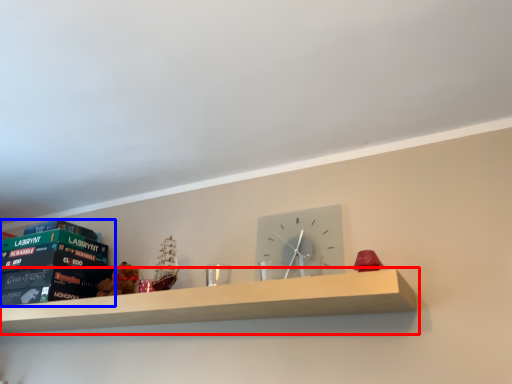
Question: Among these objects, which one is nearest to the camera, shelf (highlighted by a red box) or paperback book (highlighted by a blue box)?

Choices:
 (A) shelf
 (B) paperback book

Answer: (A)